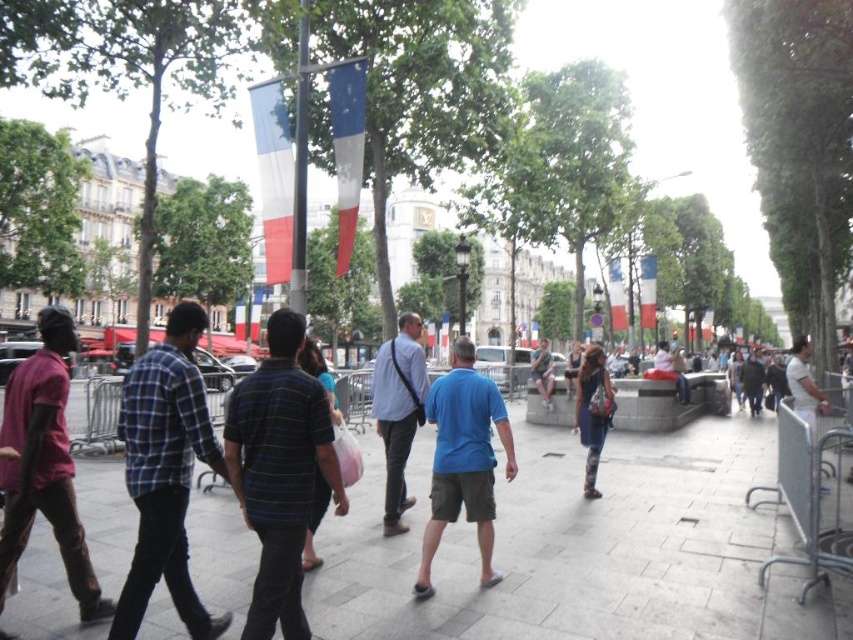
Question: Is blue cotton shirt at center bigger than red fabric cushion at center?

Choices:
 (A) no
 (B) yes

Answer: (A)

Question: Can you confirm if striped cotton shirt at center is wider than striped shirt at center?

Choices:
 (A) yes
 (B) no

Answer: (A)

Question: Based on their relative distances, which object is farther from the denim shorts at center?

Choices:
 (A) striped cotton shirt at center
 (B) gray concrete pavement at center

Answer: (A)

Question: Which of the following is the farthest from the observer?

Choices:
 (A) gray concrete pavement at center
 (B) denim shorts at center
 (C) matte blue shirt at center
 (D) striped cotton shirt at center

Answer: (B)

Question: Based on their relative distances, which object is farther from the matte blue shirt at center?

Choices:
 (A) gray concrete pavement at center
 (B) denim shorts at center
 (C) striped cotton shirt at center
 (D) blue plaid shirt at left

Answer: (B)

Question: Is gray concrete pavement at center thinner than striped cotton shirt at center?

Choices:
 (A) yes
 (B) no

Answer: (B)